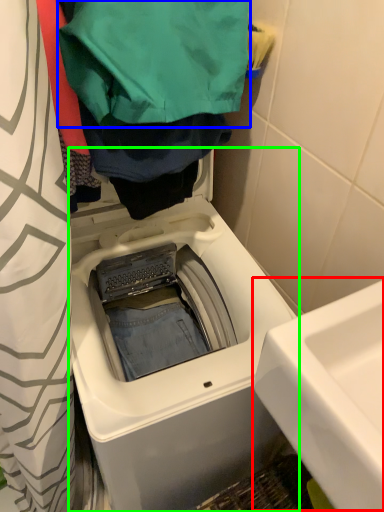
Question: Which object is the farthest from sink (highlighted by a red box)? Choose among these: clothing (highlighted by a blue box) or washing machine (highlighted by a green box).

Choices:
 (A) clothing
 (B) washing machine

Answer: (A)